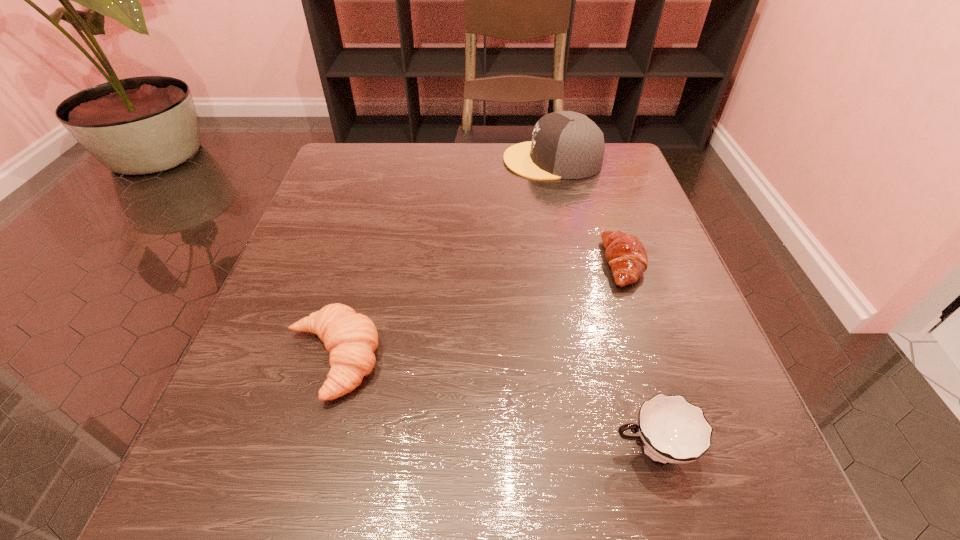
Find the location of a particular element. the third closest object to the leftmost object is located at coordinates (565, 145).

Locate an element on the screen. This screenshot has width=960, height=540. free point that satisfies the following two spatial constraints: 1. on the side of the nearest object with the handle; 2. on the front-facing side of the cap is located at coordinates (570, 160).

The height and width of the screenshot is (540, 960). I want to click on vacant area in the image that satisfies the following two spatial constraints: 1. on the front-facing side of the farthest object; 2. on the side of the cup with the handle, so click(x=616, y=449).

Locate an element on the screen. vacant space that satisfies the following two spatial constraints: 1. on the front-facing side of the farthest object; 2. on the left side of the second farthest object is located at coordinates (575, 264).

Where is `blank area in the image that satisfies the following two spatial constraints: 1. on the side of the shortest object with the handle; 2. on the left side of the cup`? The image size is (960, 540). blank area in the image that satisfies the following two spatial constraints: 1. on the side of the shortest object with the handle; 2. on the left side of the cup is located at coordinates (599, 264).

This screenshot has height=540, width=960. I want to click on vacant position in the image that satisfies the following two spatial constraints: 1. on the side of the right crescent roll with the handle; 2. on the right side of the nearest object, so click(599, 264).

This screenshot has height=540, width=960. Find the location of `vacant region that satisfies the following two spatial constraints: 1. on the side of the farther crescent roll with the handle; 2. on the left side of the cup`. vacant region that satisfies the following two spatial constraints: 1. on the side of the farther crescent roll with the handle; 2. on the left side of the cup is located at coordinates (599, 264).

Find the location of `free space that satisfies the following two spatial constraints: 1. on the side of the nearest object with the handle; 2. on the back side of the right crescent roll`. free space that satisfies the following two spatial constraints: 1. on the side of the nearest object with the handle; 2. on the back side of the right crescent roll is located at coordinates (599, 264).

You are a GUI agent. You are given a task and a screenshot of the screen. Output one action in this format:
    pyautogui.click(x=<x>, y=<y>)
    Task: Click on the vacant region that satisfies the following two spatial constraints: 1. on the side of the cup with the handle; 2. on the front side of the third farthest object
    The width and height of the screenshot is (960, 540).
    Given the screenshot: What is the action you would take?
    pyautogui.click(x=626, y=360)

Where is `vacant point that satisfies the following two spatial constraints: 1. on the front side of the leftmost object; 2. on the side of the nearest object with the handle`? vacant point that satisfies the following two spatial constraints: 1. on the front side of the leftmost object; 2. on the side of the nearest object with the handle is located at coordinates (306, 449).